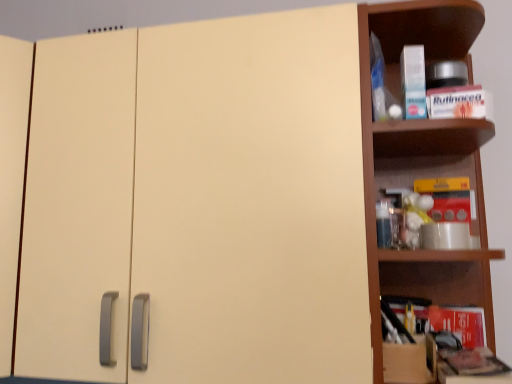
Question: From the image's perspective, does cardboard box at right appear lower than brown wooden shelf at right?

Choices:
 (A) yes
 (B) no

Answer: (A)

Question: Does cardboard box at right have a lesser height compared to brown wooden shelf at right?

Choices:
 (A) yes
 (B) no

Answer: (A)

Question: Can you confirm if cardboard box at right is bigger than brown wooden shelf at right?

Choices:
 (A) no
 (B) yes

Answer: (A)

Question: Is cardboard box at right facing away from brown wooden shelf at right?

Choices:
 (A) yes
 (B) no

Answer: (A)

Question: From a real-world perspective, is cardboard box at right located higher than brown wooden shelf at right?

Choices:
 (A) yes
 (B) no

Answer: (B)

Question: Is matte cream cabinet at center inside or outside of brown wooden shelf at right?

Choices:
 (A) outside
 (B) inside

Answer: (A)

Question: In the image, is matte cream cabinet at center positioned in front of or behind brown wooden shelf at right?

Choices:
 (A) behind
 (B) front

Answer: (B)

Question: From their relative heights in the image, would you say matte cream cabinet at center is taller or shorter than brown wooden shelf at right?

Choices:
 (A) short
 (B) tall

Answer: (A)

Question: Looking at their shapes, would you say matte cream cabinet at center is wider or thinner than brown wooden shelf at right?

Choices:
 (A) wide
 (B) thin

Answer: (A)

Question: From a real-world perspective, is cardboard box at right physically located above or below brown wooden shelf at right?

Choices:
 (A) below
 (B) above

Answer: (A)

Question: Is cardboard box at right taller or shorter than brown wooden shelf at right?

Choices:
 (A) short
 (B) tall

Answer: (A)

Question: Relative to brown wooden shelf at right, is cardboard box at right in front or behind?

Choices:
 (A) behind
 (B) front

Answer: (A)

Question: From the image's perspective, is cardboard box at right positioned above or below brown wooden shelf at right?

Choices:
 (A) below
 (B) above

Answer: (A)

Question: Is cardboard box at right wider or thinner than matte cream cabinet at center?

Choices:
 (A) thin
 (B) wide

Answer: (A)

Question: Is cardboard box at right in front of or behind matte cream cabinet at center in the image?

Choices:
 (A) behind
 (B) front

Answer: (A)